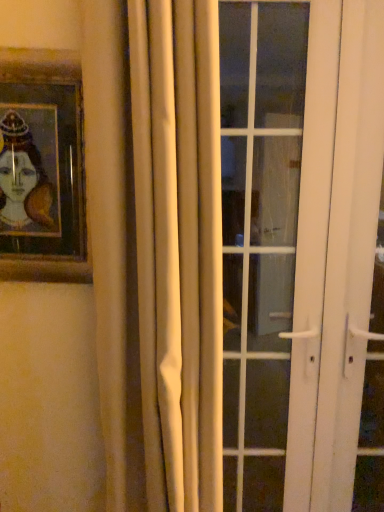
Question: Relative to white matte curtain at center, is white glass door at center in front or behind?

Choices:
 (A) front
 (B) behind

Answer: (B)

Question: Is point (256, 335) positioned closer to the camera than point (147, 471)?

Choices:
 (A) farther
 (B) closer

Answer: (A)

Question: Considering the real-world distances, which object is closest to the wooden framed portrait at upper left?

Choices:
 (A) white matte curtain at center
 (B) white glass door at center

Answer: (A)

Question: Based on their relative distances, which object is farther from the white glass door at center?

Choices:
 (A) white matte curtain at center
 (B) wooden framed portrait at upper left

Answer: (B)